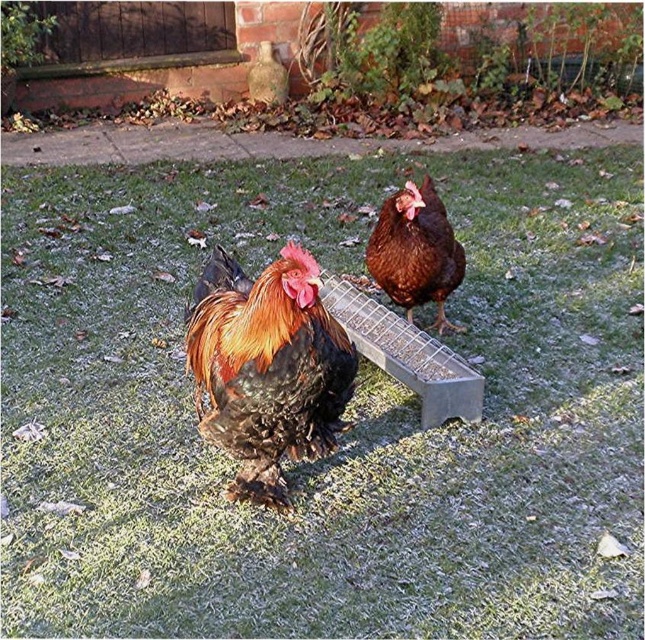
You are a photographer trying to capture both the shiny brown rooster at center and the brown matte chicken at center in a single frame. Considering their heights, which one will appear larger in the photo?

The shiny brown rooster at center is much taller than the brown matte chicken at center, so it will appear larger in the photo.

Based on the photo, you are a photographer aiming to capture the shiny brown rooster at center in your shot. Based on its position, which direction should you move your camera to ensure it is centered in the frame?

The shiny brown rooster at center is already positioned at the center point of the image, so no adjustment is needed. It is already centered at coordinates 0.575 on the x and 0.416 on the y axis.

You are a farmer checking on your chickens in the frosty backyard. You notice the shiny brown rooster at center and the brown matte chicken at center. Which chicken would cast a bigger shadow on the frosty ground?

The shiny brown rooster at center has a larger size compared to the brown matte chicken at center, so it would cast a bigger shadow on the frosty ground.